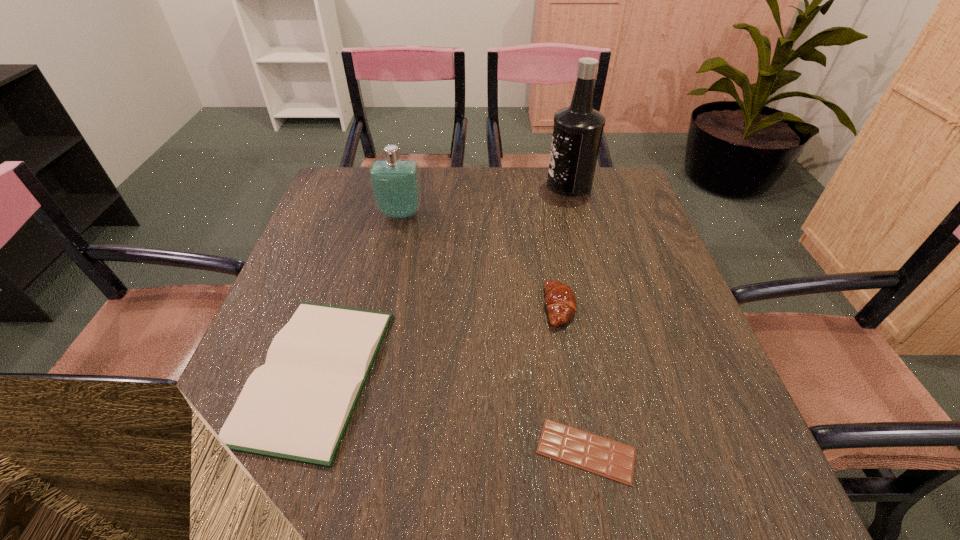
The height and width of the screenshot is (540, 960). What are the coordinates of `object present at the near left corner` in the screenshot? It's located at (297, 406).

Locate an element on the screen. This screenshot has height=540, width=960. object that is at the far right corner is located at coordinates (577, 132).

You are a GUI agent. You are given a task and a screenshot of the screen. Output one action in this format:
    pyautogui.click(x=<x>, y=<y>)
    Task: Click on the vacant space at the far edge of the desktop
    
    Given the screenshot: What is the action you would take?
    pyautogui.click(x=478, y=212)

Locate an element on the screen. This screenshot has height=540, width=960. free space at the near edge of the desktop is located at coordinates (471, 463).

The height and width of the screenshot is (540, 960). In order to click on free point at the left edge in this screenshot , I will do `click(350, 230)`.

Identify the location of free location at the right edge. This screenshot has height=540, width=960. click(676, 432).

You are a GUI agent. You are given a task and a screenshot of the screen. Output one action in this format:
    pyautogui.click(x=<x>, y=<y>)
    Task: Click on the free space at the far left corner
    The width and height of the screenshot is (960, 540).
    Given the screenshot: What is the action you would take?
    pyautogui.click(x=346, y=195)

Where is `vacant space that is in between the tallest object and the fourth tallest object`? The width and height of the screenshot is (960, 540). vacant space that is in between the tallest object and the fourth tallest object is located at coordinates (442, 279).

I want to click on vacant space that's between the chocolate bar and the liquor, so click(x=578, y=318).

Locate an element on the screen. The width and height of the screenshot is (960, 540). vacant point located between the crescent roll and the second farthest object is located at coordinates (480, 260).